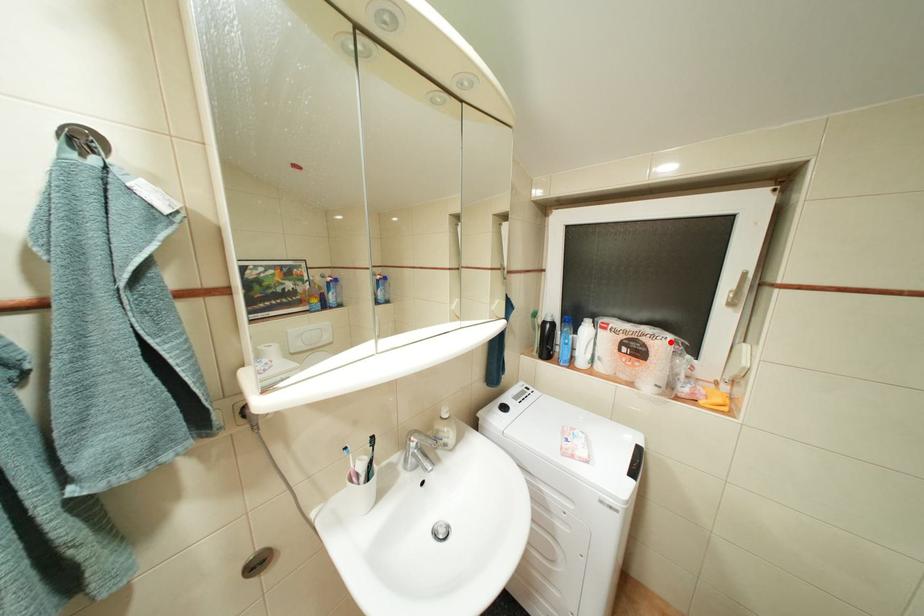
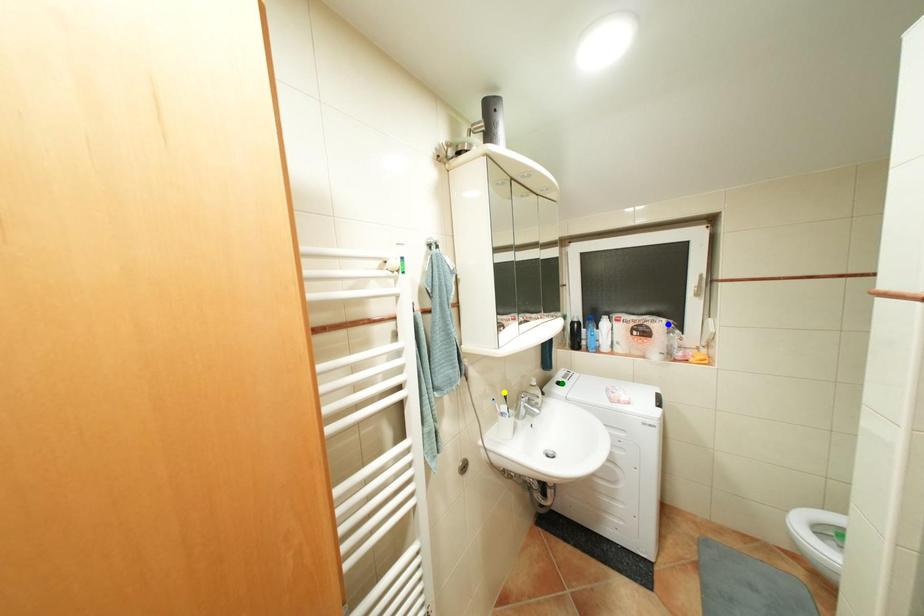
Question: I am providing you with two images of the same scene from different viewpoints. A red point is marked on the first image. You are given multiple points on the second image. In image 2, which mark is for the same physical point as the one in image 1?

Choices:
 (A) blue point
 (B) green point
 (C) yellow point

Answer: (A)